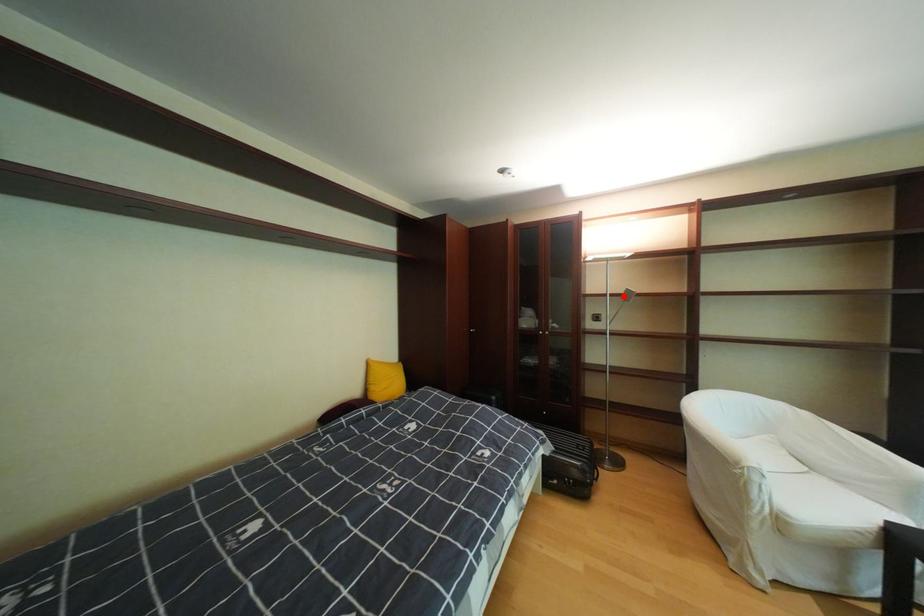
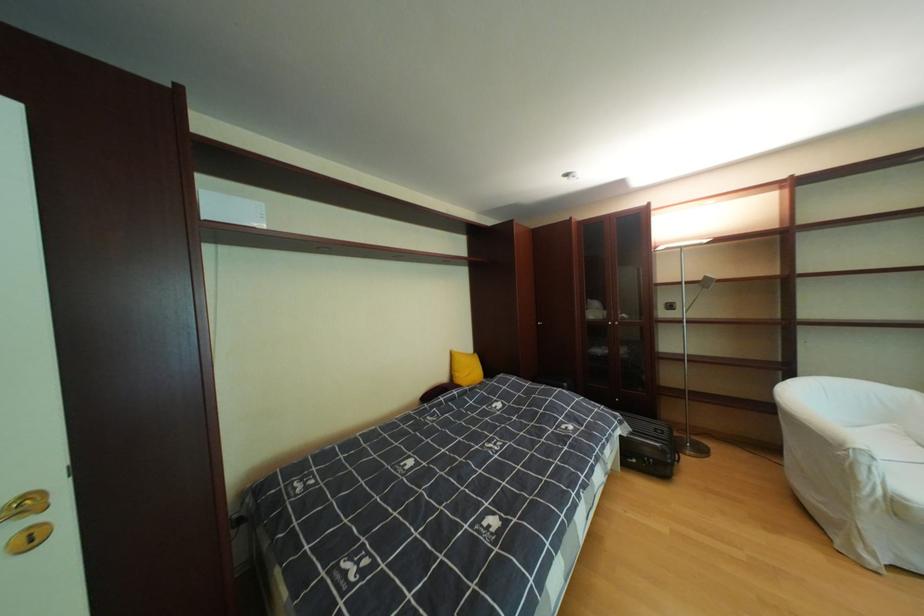
Locate, in the second image, the point that corresponds to the highlighted location in the first image.

(699, 284)